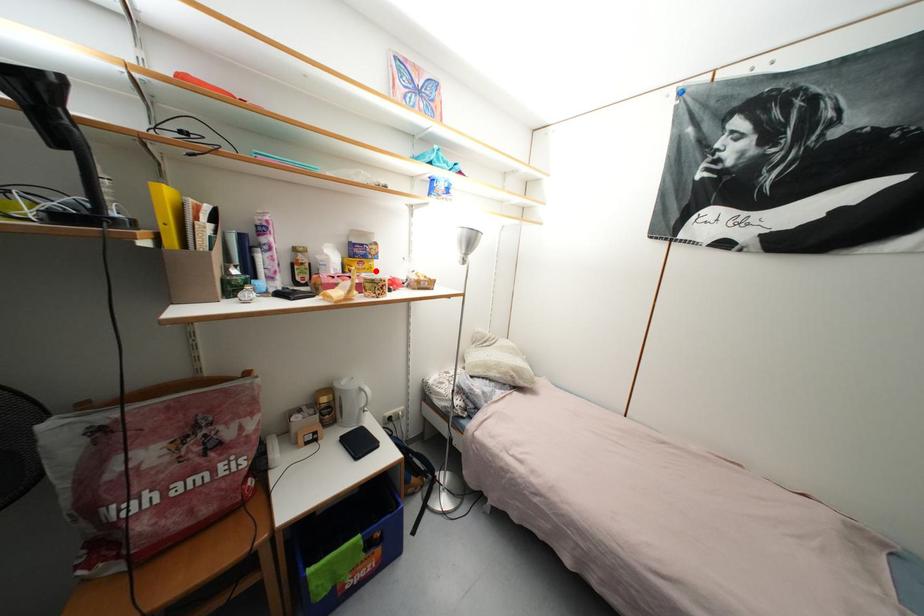
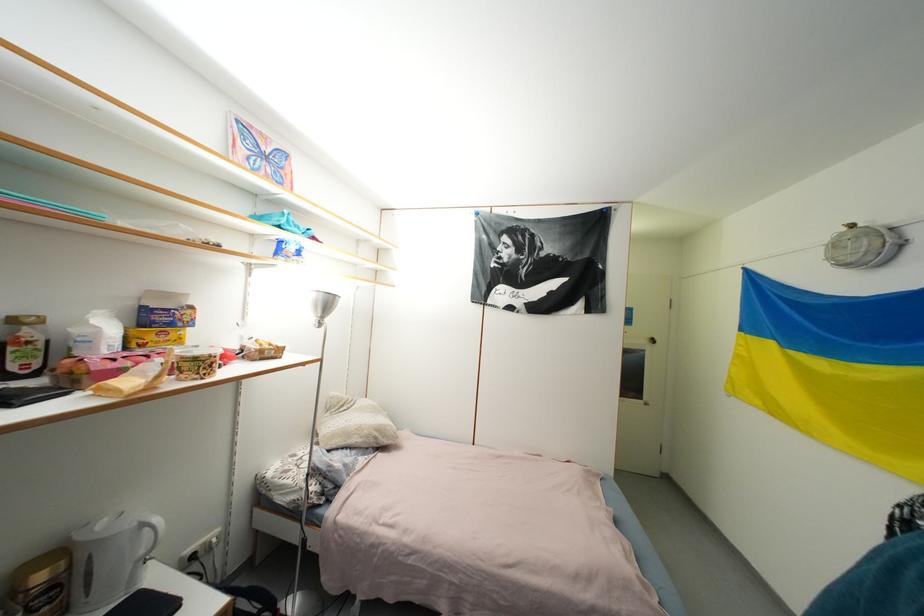
In the second image, find the point that corresponds to the highlighted location in the first image.

(185, 342)